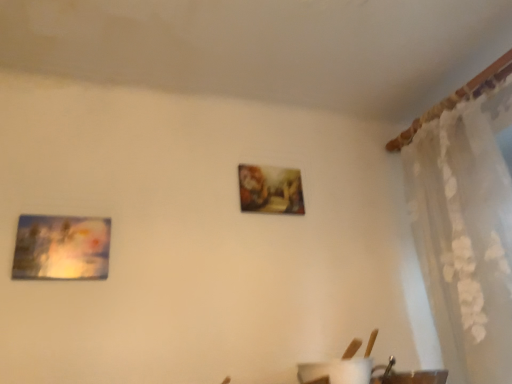
Question: Considering the relative sizes of matte plastic picture frame at left and white sheer curtain at upper right in the image provided, is matte plastic picture frame at left smaller than white sheer curtain at upper right?

Choices:
 (A) yes
 (B) no

Answer: (A)

Question: Could white sheer curtain at upper right be considered to be inside matte plastic picture frame at left?

Choices:
 (A) yes
 (B) no

Answer: (B)

Question: Considering the relative sizes of matte plastic picture frame at left and white sheer curtain at upper right in the image provided, is matte plastic picture frame at left shorter than white sheer curtain at upper right?

Choices:
 (A) no
 (B) yes

Answer: (B)

Question: Considering the relative sizes of matte plastic picture frame at left and white sheer curtain at upper right in the image provided, is matte plastic picture frame at left taller than white sheer curtain at upper right?

Choices:
 (A) yes
 (B) no

Answer: (B)

Question: From the image's perspective, is matte plastic picture frame at left located above white sheer curtain at upper right?

Choices:
 (A) no
 (B) yes

Answer: (A)

Question: Is matte plastic picture frame at left behind white sheer curtain at upper right?

Choices:
 (A) no
 (B) yes

Answer: (B)

Question: Does white sheer curtain at upper right have a lesser height compared to matte plastic picture frame at left?

Choices:
 (A) yes
 (B) no

Answer: (B)

Question: Is white sheer curtain at upper right turned away from matte plastic picture frame at left?

Choices:
 (A) yes
 (B) no

Answer: (B)

Question: Is there a large distance between white sheer curtain at upper right and matte plastic picture frame at left?

Choices:
 (A) no
 (B) yes

Answer: (B)

Question: Could you tell me if white sheer curtain at upper right is turned towards matte plastic picture frame at left?

Choices:
 (A) yes
 (B) no

Answer: (A)

Question: Is white sheer curtain at upper right at the left side of matte plastic picture frame at left?

Choices:
 (A) no
 (B) yes

Answer: (A)

Question: Can you confirm if white sheer curtain at upper right is taller than matte plastic picture frame at left?

Choices:
 (A) yes
 (B) no

Answer: (A)

Question: Based on their sizes in the image, would you say white sheer curtain at upper right is bigger or smaller than matte plastic picture frame at left?

Choices:
 (A) small
 (B) big

Answer: (B)